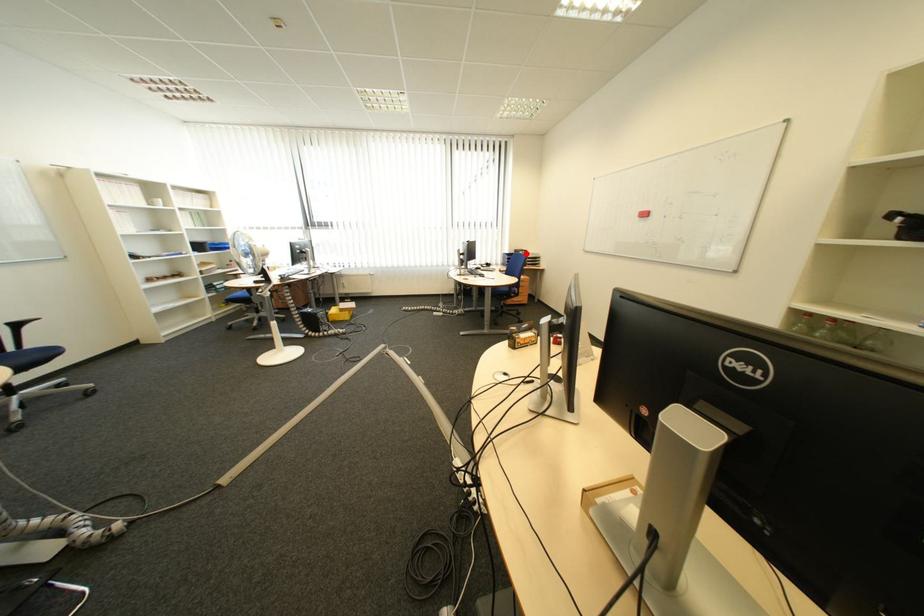
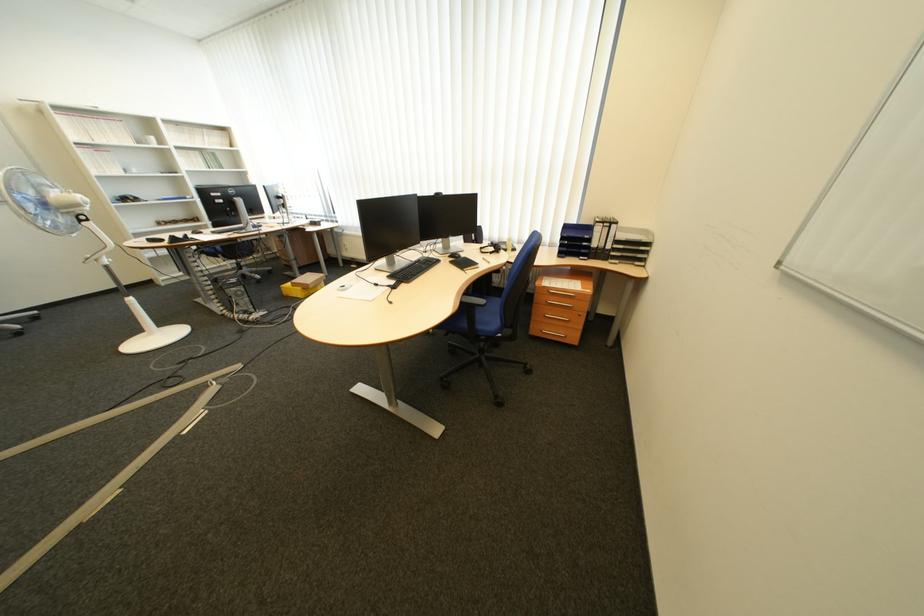
Where in the second image is the point corresponding to the highlighted location from the first image?

(604, 225)